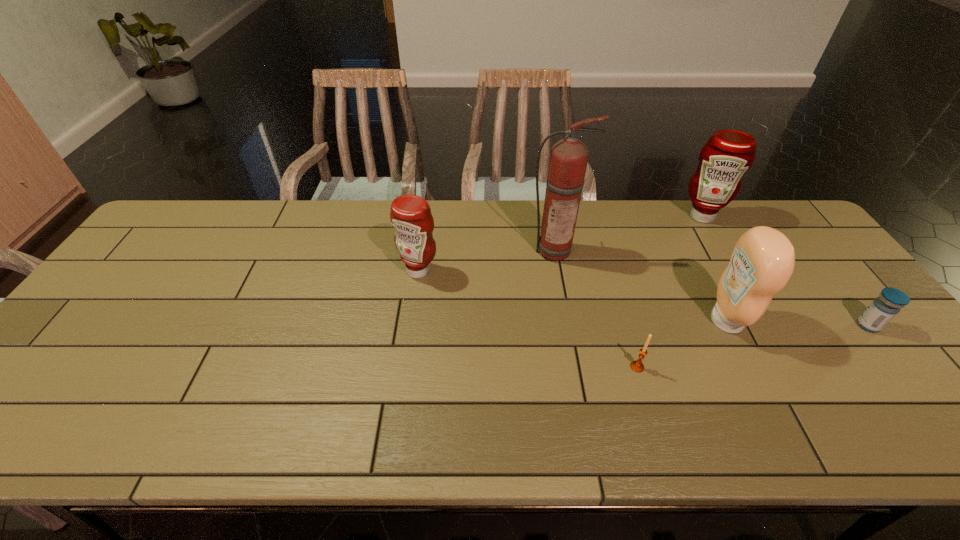
Find the location of a particular element. The image size is (960, 540). vacant area situated on the left of the farthest condiment is located at coordinates (619, 216).

Locate an element on the screen. This screenshot has width=960, height=540. vacant position located 0.060m on the label of the nearest condiment is located at coordinates (685, 321).

The image size is (960, 540). Find the location of `blank space located on the label of the nearest condiment`. blank space located on the label of the nearest condiment is located at coordinates (574, 321).

This screenshot has height=540, width=960. I want to click on vacant space located on the label of the nearest condiment, so click(643, 321).

At what (x,y) coordinates should I click in order to perform the action: click on vacant space situated on the front of the shortest condiment. Please return your answer as a coordinate pair (x, y). This screenshot has width=960, height=540. Looking at the image, I should click on (412, 318).

The height and width of the screenshot is (540, 960). I want to click on blank space located on the front of the candle_holder, so pos(649,408).

Identify the location of vacant region located on the back of the medicine. Image resolution: width=960 pixels, height=540 pixels. (791, 228).

Where is `fire extinguisher present at the far edge`? This screenshot has width=960, height=540. fire extinguisher present at the far edge is located at coordinates (568, 160).

This screenshot has width=960, height=540. I want to click on condiment that is at the far edge, so click(x=726, y=156).

Locate an element on the screen. object positioned at the right edge is located at coordinates (883, 309).